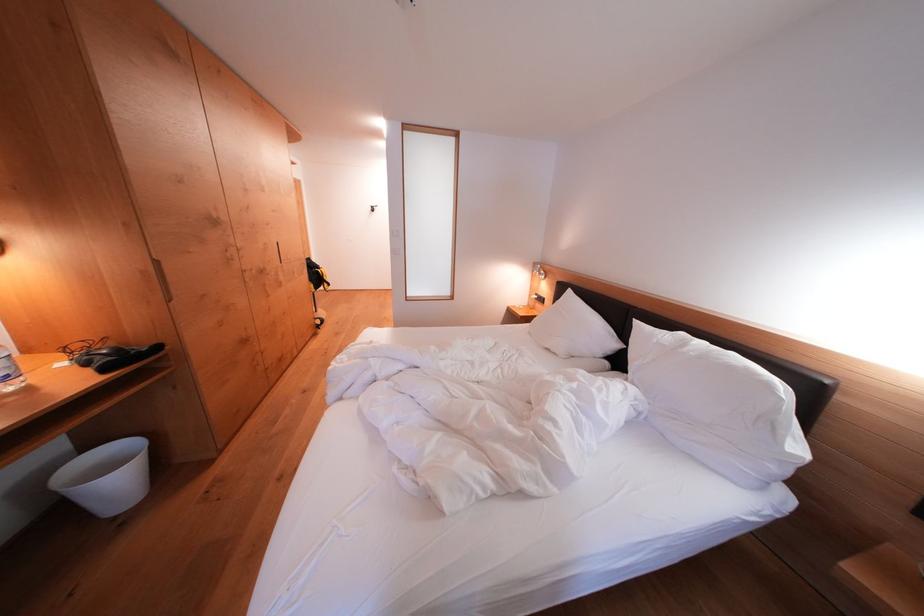
What are the coordinates of `lamp switch` in the screenshot? It's located at (536, 304).